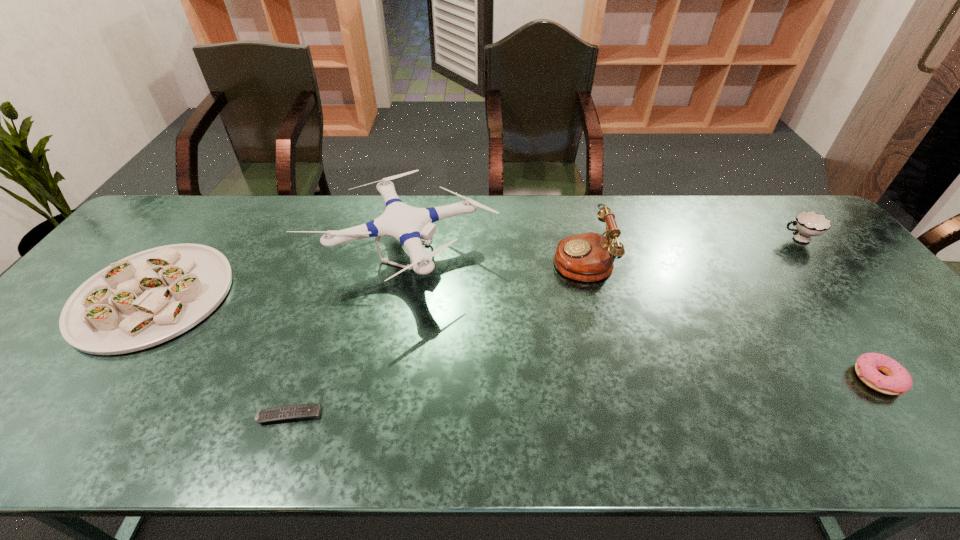
I want to click on vacant space that's between the cup and the leftmost object, so click(475, 267).

Where is `empty location between the second nearest object and the third tallest object`? This screenshot has height=540, width=960. empty location between the second nearest object and the third tallest object is located at coordinates (837, 309).

I want to click on object that is the fourth closest to the fourth object from left to right, so click(302, 411).

Identify the location of object that is the second closest one to the drone. (148, 298).

You are a GUI agent. You are given a task and a screenshot of the screen. Output one action in this format:
    pyautogui.click(x=<x>, y=<y>)
    Task: Click on the vacant space that satisfies the following two spatial constraints: 1. on the back side of the drone; 2. on the side of the cup with the handle
    
    Given the screenshot: What is the action you would take?
    pyautogui.click(x=405, y=239)

Where is `free space that satisfies the following two spatial constraints: 1. on the dial of the fourth object from left to right; 2. on the left side of the second nearest object`? free space that satisfies the following two spatial constraints: 1. on the dial of the fourth object from left to right; 2. on the left side of the second nearest object is located at coordinates (612, 379).

I want to click on free space that satisfies the following two spatial constraints: 1. on the back side of the drone; 2. on the side of the fourth shortest object with the handle, so click(405, 239).

Find the location of a particular element. free space that satisfies the following two spatial constraints: 1. on the back side of the nearest object; 2. on the side of the third tallest object with the handle is located at coordinates (348, 239).

This screenshot has height=540, width=960. Find the location of `vacant space that satisfies the following two spatial constraints: 1. on the back side of the drone; 2. on the right side of the shortest object`. vacant space that satisfies the following two spatial constraints: 1. on the back side of the drone; 2. on the right side of the shortest object is located at coordinates (343, 256).